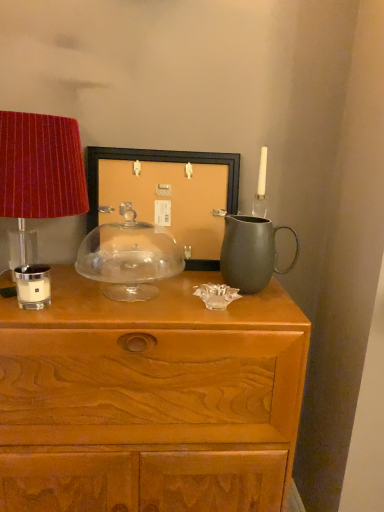
The image size is (384, 512). I want to click on vacant space behind white matte candle holder at left, which is the 2th candle holder from right to left, so click(x=66, y=283).